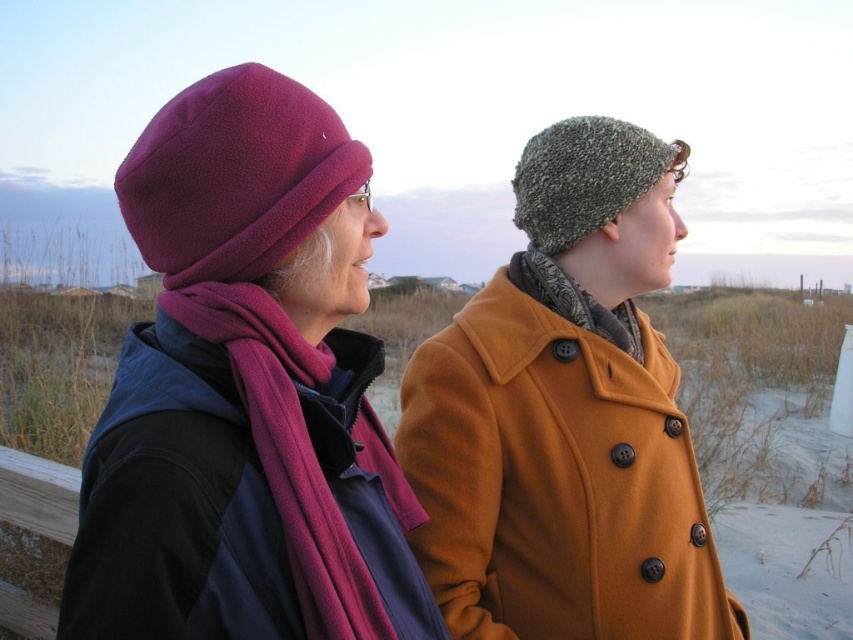
Question: Which object is the farthest from the mustard woolen coat at right?

Choices:
 (A) matte purple beanie at left
 (B) fuzzy purple beanie at left

Answer: (B)

Question: Is matte purple beanie at left to the left of mustard woolen coat at right from the viewer's perspective?

Choices:
 (A) no
 (B) yes

Answer: (B)

Question: Can you confirm if fuzzy purple beanie at left is positioned below fuzzy pink scarf at center?

Choices:
 (A) yes
 (B) no

Answer: (B)

Question: Does mustard woolen coat at right appear over fuzzy purple beanie at left?

Choices:
 (A) no
 (B) yes

Answer: (A)

Question: Which point appears closest to the camera in this image?

Choices:
 (A) (560, 148)
 (B) (94, 566)
 (C) (398, 468)

Answer: (B)

Question: Among these objects, which one is farthest from the camera?

Choices:
 (A) fuzzy pink scarf at center
 (B) green knitted beanie at upper right
 (C) fuzzy purple beanie at left
 (D) mustard woolen coat at right

Answer: (B)